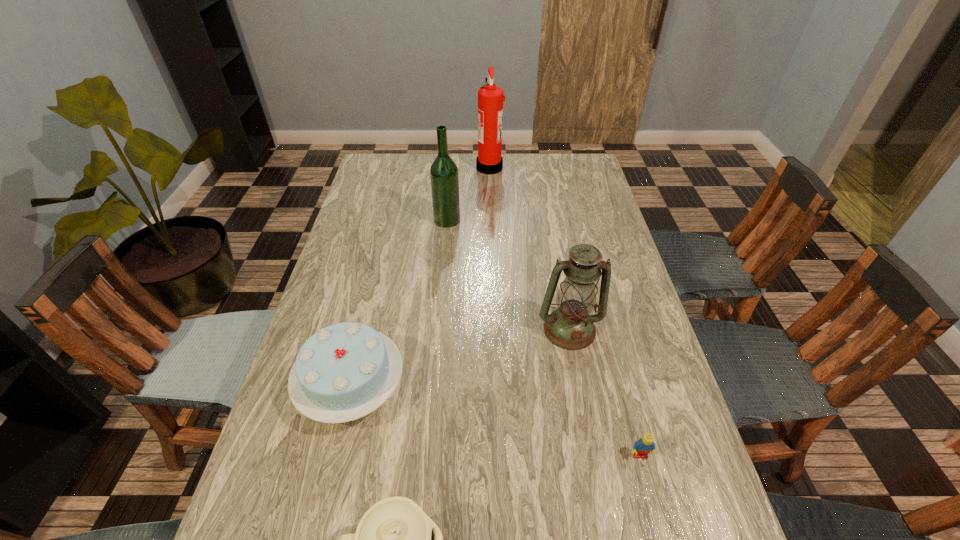
At what (x,y) coordinates should I click in order to perform the action: click on free space at the right edge of the desktop. Please return your answer as a coordinate pair (x, y). Looking at the image, I should click on (x=587, y=192).

Where is `vacant space at the far left corner`? The image size is (960, 540). vacant space at the far left corner is located at coordinates (404, 157).

Locate an element on the screen. vacant area that lies between the oil lamp and the birthday cake is located at coordinates (461, 359).

I want to click on unoccupied position between the birthday cake and the oil lamp, so click(461, 359).

Image resolution: width=960 pixels, height=540 pixels. Identify the location of free space between the birthday cake and the fifth nearest object. (399, 303).

Locate which object is the fifth closest to the alcohol. Please provide its 2D coordinates. Your answer should be formatted as a tuple, i.e. [(x, y)], where the tuple contains the x and y coordinates of a point satisfying the conditions above.

[(395, 539)]

Where is `object identified as the third closest to the nearest object`? object identified as the third closest to the nearest object is located at coordinates (570, 326).

Where is `free space that satisfies the following two spatial constraints: 1. with the nozzle aimed from the fire extinguisher; 2. on the front side of the fifth nearest object`? free space that satisfies the following two spatial constraints: 1. with the nozzle aimed from the fire extinguisher; 2. on the front side of the fifth nearest object is located at coordinates (492, 220).